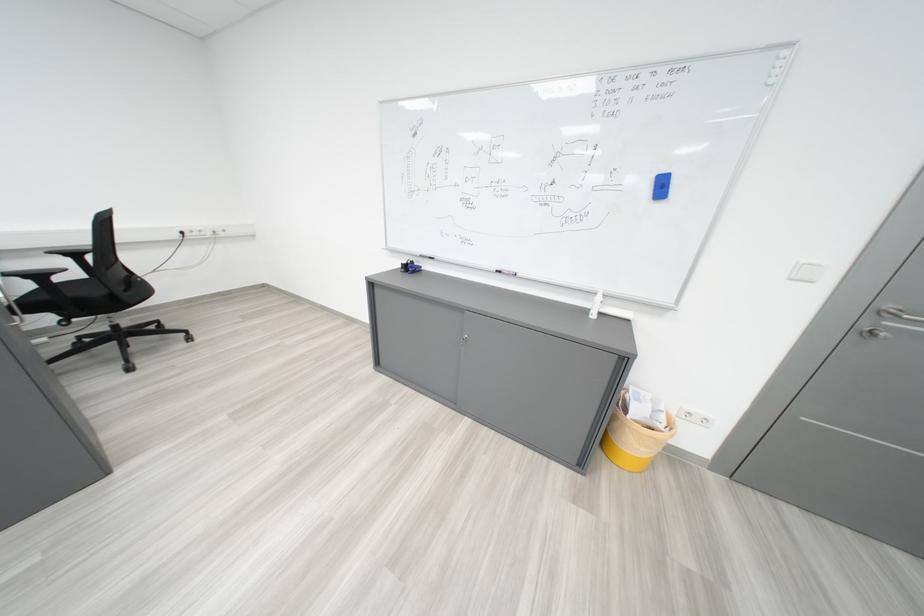
Identify the location of grey door handle. (882, 322).